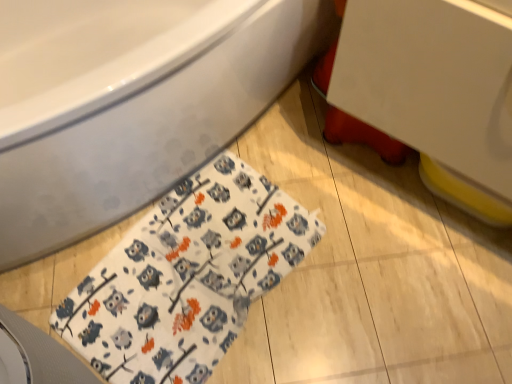
Question: Does white fabric with owl pattern at lower left appear on the right side of white glossy sink at upper right?

Choices:
 (A) yes
 (B) no

Answer: (B)

Question: From a real-world perspective, is white fabric with owl pattern at lower left positioned under white glossy sink at upper right based on gravity?

Choices:
 (A) yes
 (B) no

Answer: (A)

Question: Does white fabric with owl pattern at lower left have a lesser height compared to white glossy sink at upper right?

Choices:
 (A) yes
 (B) no

Answer: (A)

Question: From the image's perspective, is white fabric with owl pattern at lower left over white glossy sink at upper right?

Choices:
 (A) no
 (B) yes

Answer: (A)

Question: Is white glossy sink at upper right a part of white fabric with owl pattern at lower left?

Choices:
 (A) yes
 (B) no

Answer: (B)

Question: Relative to white glossy bathtub at upper left, is white glossy sink at upper right in front or behind?

Choices:
 (A) behind
 (B) front

Answer: (B)

Question: Which is correct: white glossy sink at upper right is inside white glossy bathtub at upper left, or outside of it?

Choices:
 (A) inside
 (B) outside

Answer: (B)

Question: From their relative heights in the image, would you say white glossy sink at upper right is taller or shorter than white glossy bathtub at upper left?

Choices:
 (A) tall
 (B) short

Answer: (B)

Question: From a real-world perspective, is white glossy sink at upper right above or below white glossy bathtub at upper left?

Choices:
 (A) above
 (B) below

Answer: (A)

Question: Based on their sizes in the image, would you say white glossy sink at upper right is bigger or smaller than white fabric with owl pattern at lower left?

Choices:
 (A) big
 (B) small

Answer: (A)

Question: From a real-world perspective, is white glossy sink at upper right above or below white fabric with owl pattern at lower left?

Choices:
 (A) above
 (B) below

Answer: (A)

Question: Does point (428, 84) appear closer or farther from the camera than point (117, 269)?

Choices:
 (A) closer
 (B) farther

Answer: (A)

Question: Is white glossy sink at upper right in front of or behind white fabric with owl pattern at lower left in the image?

Choices:
 (A) front
 (B) behind

Answer: (A)

Question: From a real-world perspective, relative to white glossy sink at upper right, is white fabric with owl pattern at lower left vertically above or below?

Choices:
 (A) below
 (B) above

Answer: (A)

Question: Is point (173, 377) positioned closer to the camera than point (453, 34)?

Choices:
 (A) closer
 (B) farther

Answer: (B)